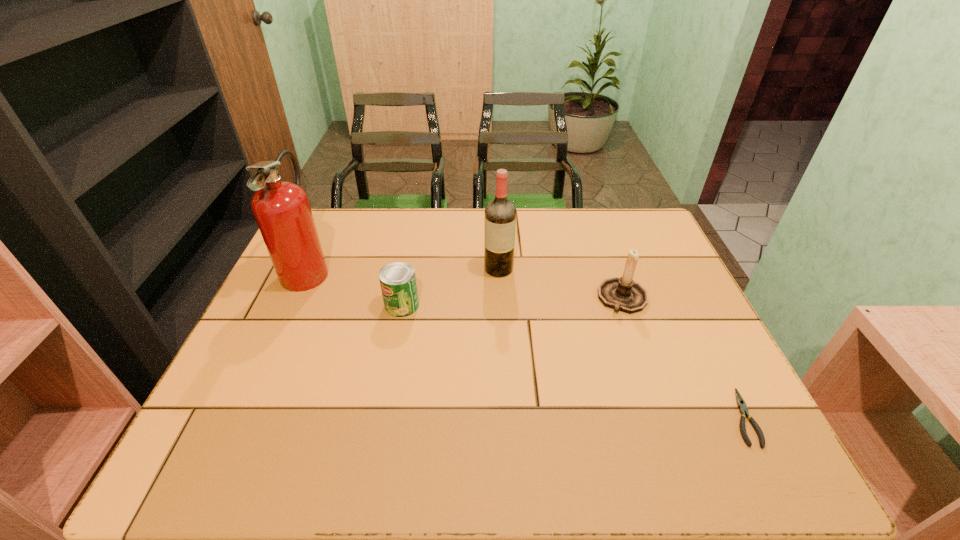
Identify the location of object that is at the far left corner. (282, 210).

Locate an element on the screen. The width and height of the screenshot is (960, 540). object at the near right corner is located at coordinates (743, 410).

Where is `free space at the far edge`? Image resolution: width=960 pixels, height=540 pixels. free space at the far edge is located at coordinates (x=467, y=225).

This screenshot has height=540, width=960. I want to click on vacant space at the near edge, so click(552, 458).

You are a GUI agent. You are given a task and a screenshot of the screen. Output one action in this format:
    pyautogui.click(x=<x>, y=<y>)
    Task: Click on the vacant space at the left edge
    The height and width of the screenshot is (540, 960).
    Given the screenshot: What is the action you would take?
    pyautogui.click(x=325, y=255)

Identify the location of free spot at the right edge of the desktop. (685, 327).

At what (x,y) coordinates should I click in order to perform the action: click on free space between the nearest object and the fire extinguisher. Please return your answer as a coordinate pair (x, y). Looking at the image, I should click on (525, 343).

Find the location of a particular element. The width and height of the screenshot is (960, 540). free area in between the candle holder and the fourth shortest object is located at coordinates (561, 284).

This screenshot has height=540, width=960. What are the coordinates of `empty space between the fourth tallest object and the nearest object` in the screenshot? It's located at (572, 361).

This screenshot has width=960, height=540. I want to click on unoccupied position between the tallest object and the second shortest object, so click(x=354, y=287).